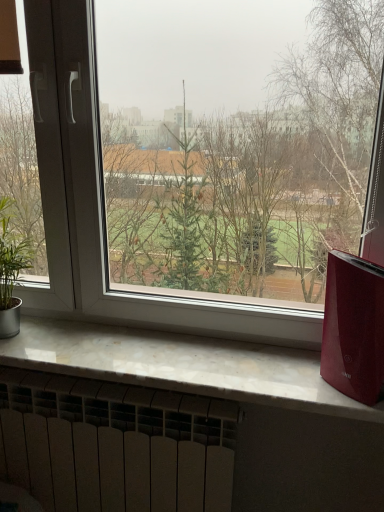
The width and height of the screenshot is (384, 512). Identify the location of vacant region below transparent glass window at center (from a real-world perspective). (166, 339).